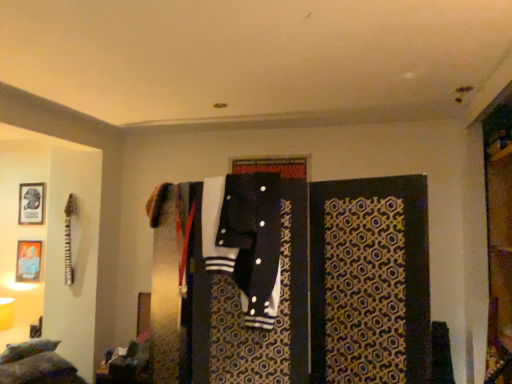
Question: Does black cotton jacket at center have a greater height compared to metallic silver picture frame at upper left, which ranks as the first picture frame in top-to-bottom order?

Choices:
 (A) no
 (B) yes

Answer: (B)

Question: From a real-world perspective, is black cotton jacket at center under metallic silver picture frame at upper left, which ranks as the first picture frame in top-to-bottom order?

Choices:
 (A) yes
 (B) no

Answer: (A)

Question: From the image's perspective, would you say black cotton jacket at center is positioned over metallic silver picture frame at upper left, which ranks as the first picture frame in top-to-bottom order?

Choices:
 (A) no
 (B) yes

Answer: (A)

Question: Is the position of black cotton jacket at center less distant than that of metallic silver picture frame at upper left, which ranks as the first picture frame in top-to-bottom order?

Choices:
 (A) yes
 (B) no

Answer: (A)

Question: Is metallic silver picture frame at upper left, which ranks as the first picture frame in top-to-bottom order, at the back of black cotton jacket at center?

Choices:
 (A) yes
 (B) no

Answer: (B)

Question: From their relative heights in the image, would you say metallic silver picture frame at upper left, which is the second picture frame from bottom to top, is taller or shorter than black fabric closet at center?

Choices:
 (A) tall
 (B) short

Answer: (B)

Question: Considering the positions of metallic silver picture frame at upper left, which is the second picture frame from bottom to top, and black fabric closet at center in the image, is metallic silver picture frame at upper left, which is the second picture frame from bottom to top, wider or thinner than black fabric closet at center?

Choices:
 (A) thin
 (B) wide

Answer: (A)

Question: Is point (24, 198) closer or farther from the camera than point (176, 215)?

Choices:
 (A) closer
 (B) farther

Answer: (B)

Question: From a real-world perspective, is metallic silver picture frame at upper left, which ranks as the first picture frame in top-to-bottom order, positioned above or below black fabric closet at center?

Choices:
 (A) above
 (B) below

Answer: (A)

Question: From the image's perspective, is metallic silver picture frame at upper left, which ranks as the first picture frame in top-to-bottom order, above or below fluffy multicolored pillows at lower left?

Choices:
 (A) above
 (B) below

Answer: (A)

Question: Considering the positions of metallic silver picture frame at upper left, which ranks as the first picture frame in top-to-bottom order, and fluffy multicolored pillows at lower left in the image, is metallic silver picture frame at upper left, which ranks as the first picture frame in top-to-bottom order, wider or thinner than fluffy multicolored pillows at lower left?

Choices:
 (A) wide
 (B) thin

Answer: (B)

Question: Considering the positions of metallic silver picture frame at upper left, which ranks as the first picture frame in top-to-bottom order, and fluffy multicolored pillows at lower left in the image, is metallic silver picture frame at upper left, which ranks as the first picture frame in top-to-bottom order, bigger or smaller than fluffy multicolored pillows at lower left?

Choices:
 (A) big
 (B) small

Answer: (B)

Question: Is metallic silver picture frame at upper left, which ranks as the first picture frame in top-to-bottom order, in front of or behind fluffy multicolored pillows at lower left in the image?

Choices:
 (A) behind
 (B) front

Answer: (A)

Question: In terms of height, does black cotton jacket at center look taller or shorter compared to black fabric closet at center?

Choices:
 (A) short
 (B) tall

Answer: (A)

Question: From a real-world perspective, is black cotton jacket at center physically located above or below black fabric closet at center?

Choices:
 (A) above
 (B) below

Answer: (A)